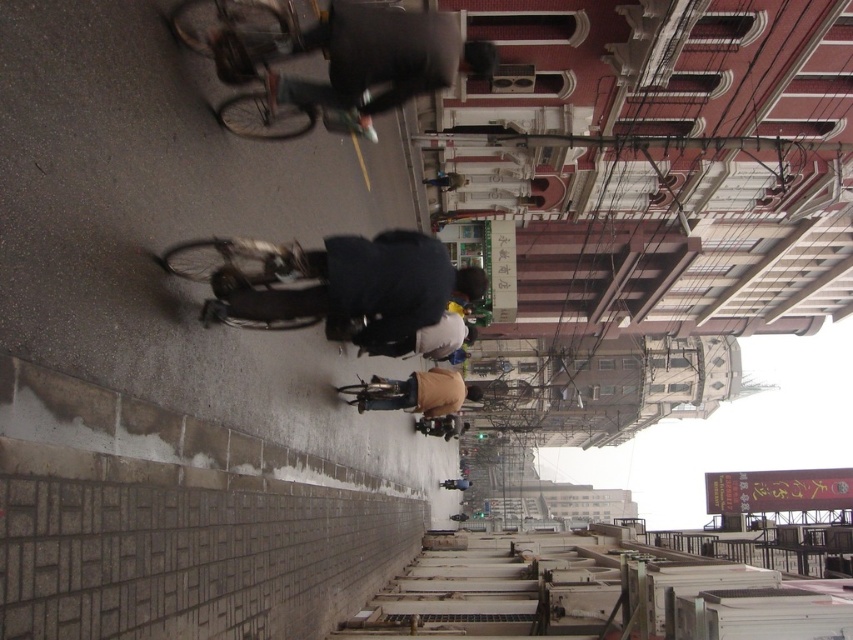
Question: Based on their relative distances, which object is nearer to the dark blue fabric jacket at center?

Choices:
 (A) tan fabric pants at center
 (B) shiny metallic bicycle at center

Answer: (B)

Question: Based on their relative distances, which object is farther from the tan fabric pants at center?

Choices:
 (A) shiny metallic bicycle at center
 (B) dark blue fabric jacket at center

Answer: (A)

Question: Considering the relative positions of dark blue fabric jacket at center and shiny metallic bicycle at center in the image provided, where is dark blue fabric jacket at center located with respect to shiny metallic bicycle at center?

Choices:
 (A) below
 (B) above

Answer: (B)

Question: Can you confirm if dark blue fabric jacket at center is bigger than tan fabric pants at center?

Choices:
 (A) no
 (B) yes

Answer: (A)

Question: Among these objects, which one is nearest to the camera?

Choices:
 (A) tan fabric pants at center
 (B) shiny metallic bicycle at center

Answer: (B)

Question: In this image, where is dark blue fabric jacket at center located relative to shiny metallic bicycle at center?

Choices:
 (A) right
 (B) left

Answer: (A)